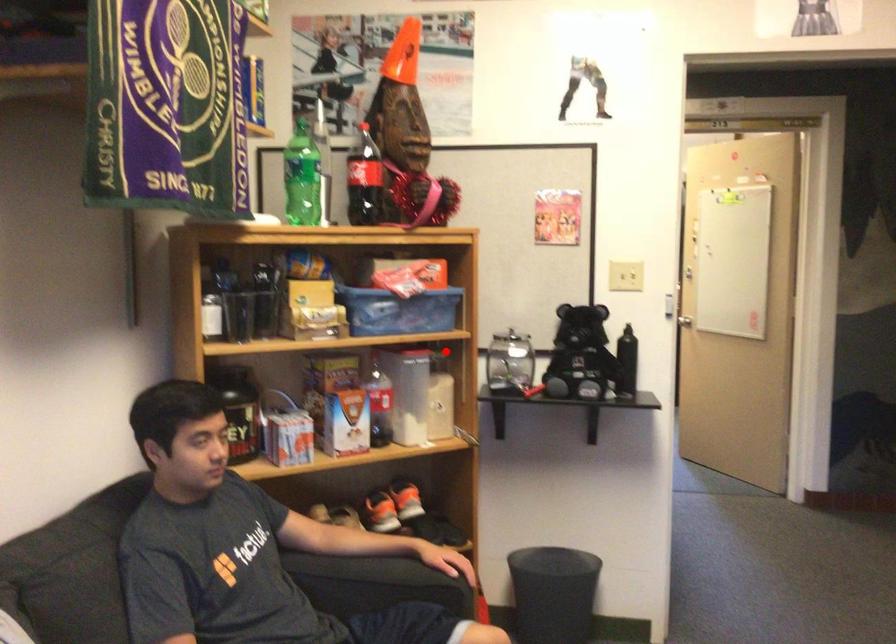
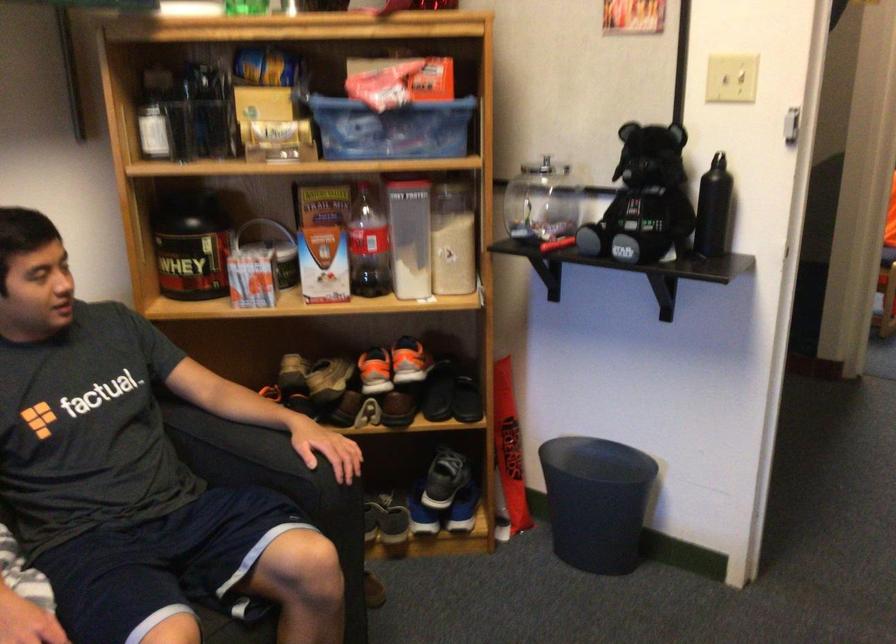
Where in the second image is the point corresponding to the highlighted location from the first image?

(455, 184)